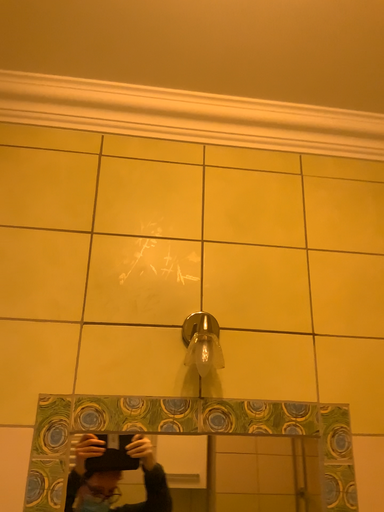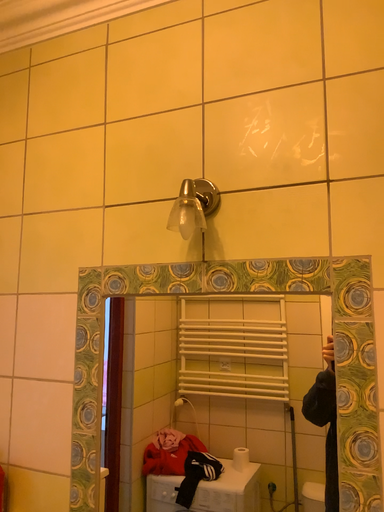
Question: Which way did the camera rotate in the video?

Choices:
 (A) rotated left
 (B) rotated right

Answer: (A)